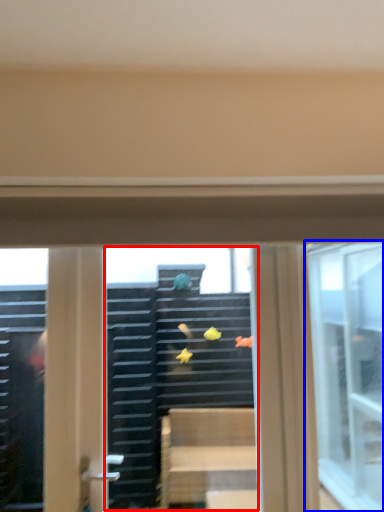
Question: Which of the following is the farthest to the observer, shop window (highlighted by a red box) or window (highlighted by a blue box)?

Choices:
 (A) shop window
 (B) window

Answer: (B)